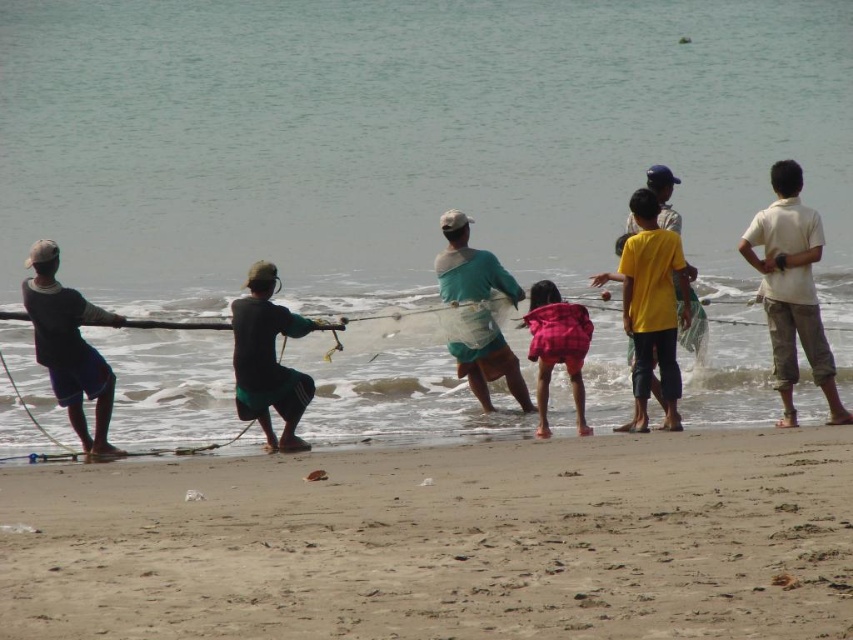
Does light beige shirt at right appear on the left side of pink plaid shirt at center?

No, light beige shirt at right is not to the left of pink plaid shirt at center.

Can you confirm if light beige shirt at right is positioned above pink plaid shirt at center?

Yes, light beige shirt at right is above pink plaid shirt at center.

Who is more forward, (781, 371) or (560, 333)?

Point (781, 371) is in front.

Locate an element on the screen. This screenshot has height=640, width=853. light beige shirt at right is located at coordinates (791, 289).

Is dark blue fabric fisherman at left below teal fabric shirt at center?

Incorrect, dark blue fabric fisherman at left is not positioned below teal fabric shirt at center.

Locate an element on the screen. This screenshot has width=853, height=640. dark blue fabric fisherman at left is located at coordinates (68, 346).

Does light beige shirt at right have a lesser width compared to dark blue fabric fisherman at left?

In fact, light beige shirt at right might be wider than dark blue fabric fisherman at left.

What do you see at coordinates (791, 289) in the screenshot?
I see `light beige shirt at right` at bounding box center [791, 289].

Identify the location of light beige shirt at right. The height and width of the screenshot is (640, 853). (791, 289).